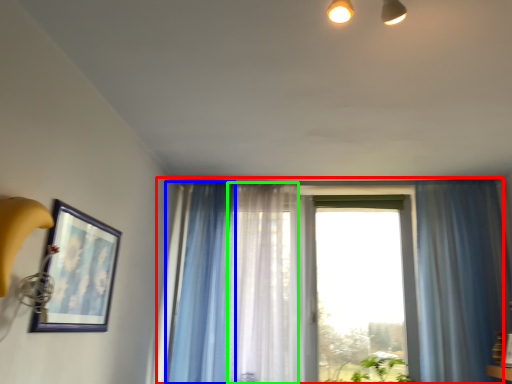
Question: Considering the real-world distances, which object is closest to window (highlighted by a red box)? curtain (highlighted by a blue box) or curtain (highlighted by a green box).

Choices:
 (A) curtain
 (B) curtain

Answer: (B)